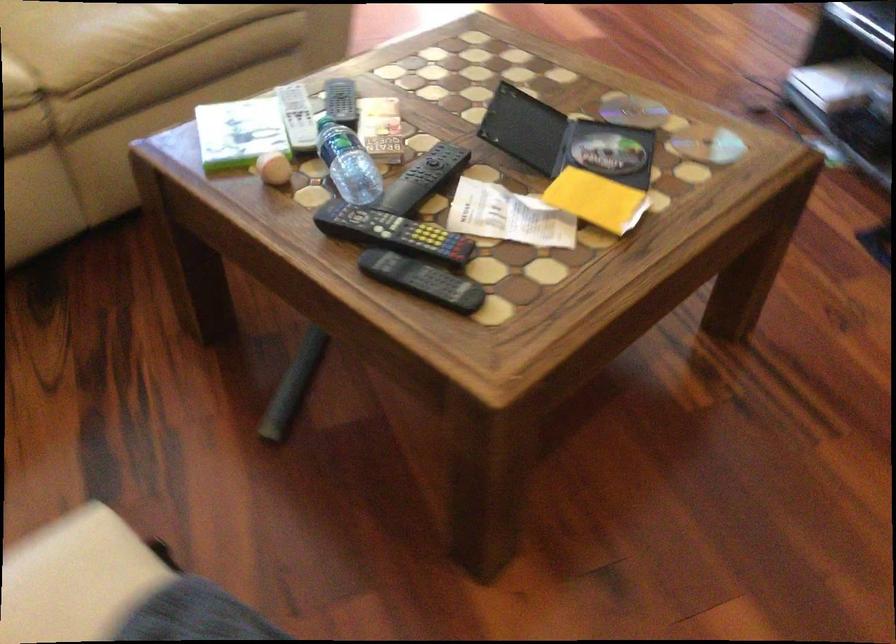
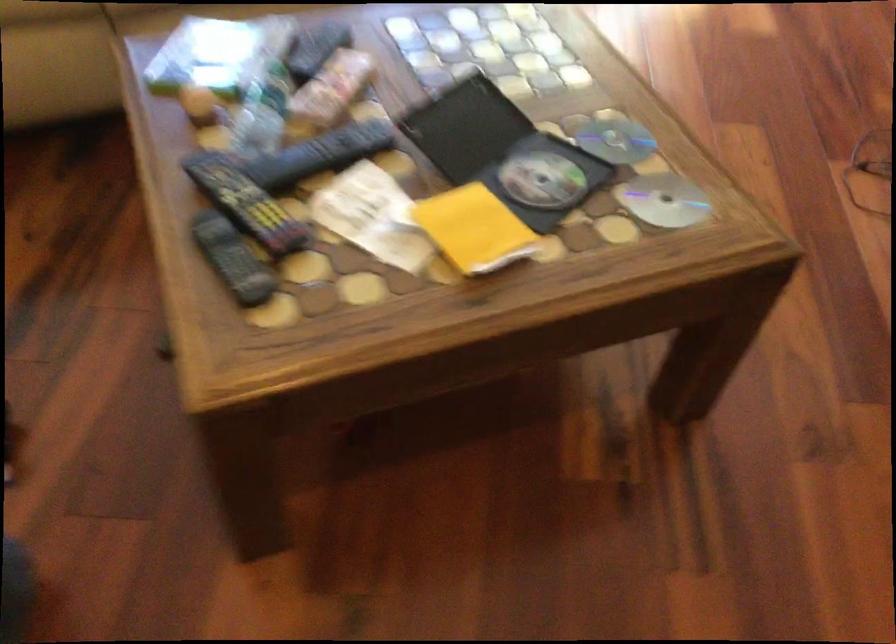
Locate, in the second image, the point that corresponds to [401,230] in the first image.

(245, 202)